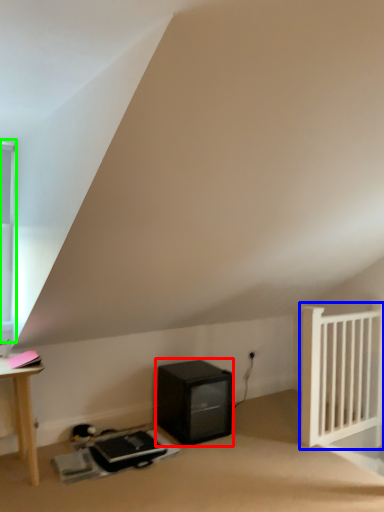
Question: Considering the real-world distances, which object is farthest from appliance (highlighted by a red box)? radiator (highlighted by a blue box) or window (highlighted by a green box)?

Choices:
 (A) radiator
 (B) window

Answer: (B)